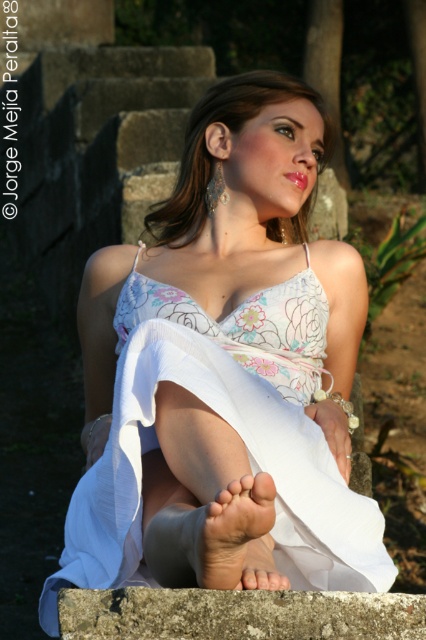
You are a photographer trying to capture the woman in the image. You notice the gray rough concrete at lower center and the glossy pink lipstick at center. Which object is closer to the camera lens?

The gray rough concrete at lower center is closer to the camera lens because it is in front of the glossy pink lipstick at center.

The woman in the image is wearing a white sheer dress at center and has glossy pink lipstick at center. Which of these items is positioned higher on her body?

The white sheer dress at center is taller than the glossy pink lipstick at center, so the dress is positioned higher on her body.

Based on the scene description, can you determine the spatial relationship between the white sheer dress at center and the dry skin foot at lower center?

The white sheer dress at center is above the dry skin foot at lower center, indicating that the dress is positioned higher up relative to the foot in the image.